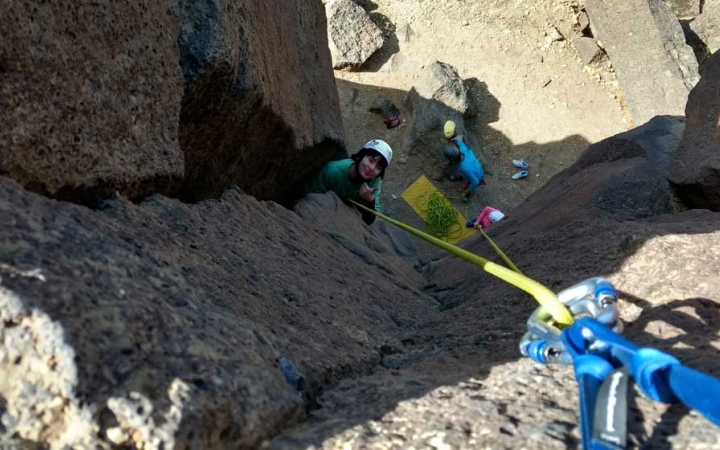
Where is `yellow towel or matt`? The width and height of the screenshot is (720, 450). yellow towel or matt is located at coordinates (410, 187).